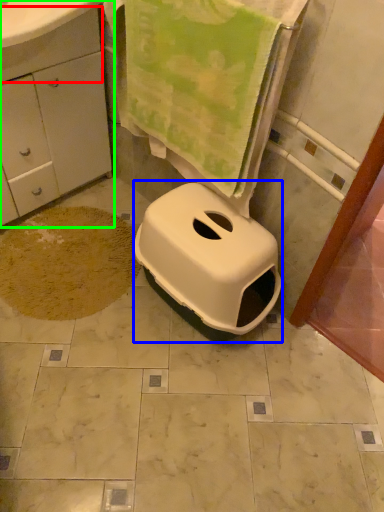
Question: Which object is positioned closest to drawer (highlighted by a red box)? Select from bidet (highlighted by a blue box) and bathroom cabinet (highlighted by a green box).

Choices:
 (A) bidet
 (B) bathroom cabinet

Answer: (B)